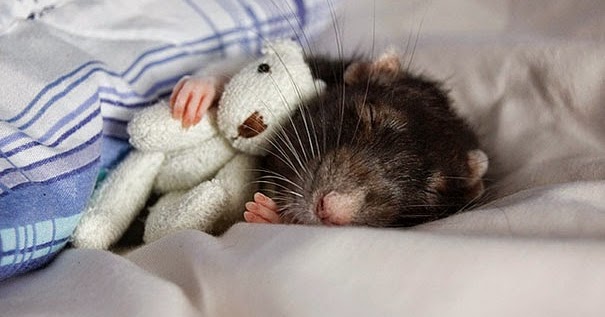
You are a GUI agent. You are given a task and a screenshot of the screen. Output one action in this format:
    pyautogui.click(x=<x>, y=<y>)
    Task: Click on the blanket
    The height and width of the screenshot is (317, 605).
    Given the screenshot: What is the action you would take?
    pyautogui.click(x=113, y=86)